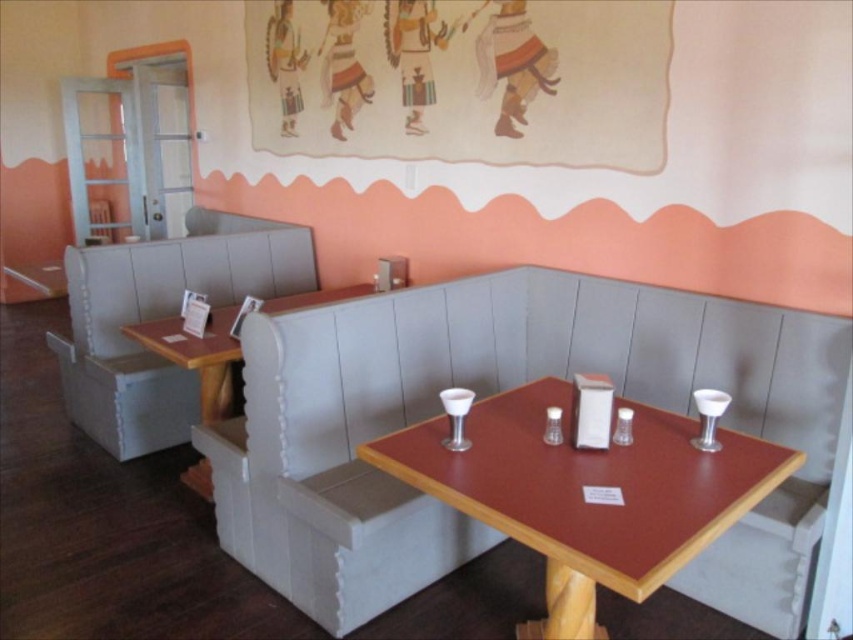
Question: Is white fabric chair at center to the right of wooden table at center from the viewer's perspective?

Choices:
 (A) no
 (B) yes

Answer: (A)

Question: Does wooden table at center appear over white fabric booth at left?

Choices:
 (A) no
 (B) yes

Answer: (A)

Question: Which is farther from the white fabric chair at center?

Choices:
 (A) white fabric booth at left
 (B) wooden table at center

Answer: (A)

Question: Estimate the real-world distances between objects in this image. Which object is farther from the white fabric booth at left?

Choices:
 (A) white fabric chair at center
 (B) wooden table at center

Answer: (B)

Question: Which point is closer to the camera taking this photo?

Choices:
 (A) (141, 369)
 (B) (605, 522)
 (C) (241, 547)

Answer: (B)

Question: Can you confirm if white fabric chair at center is thinner than white fabric booth at left?

Choices:
 (A) no
 (B) yes

Answer: (A)